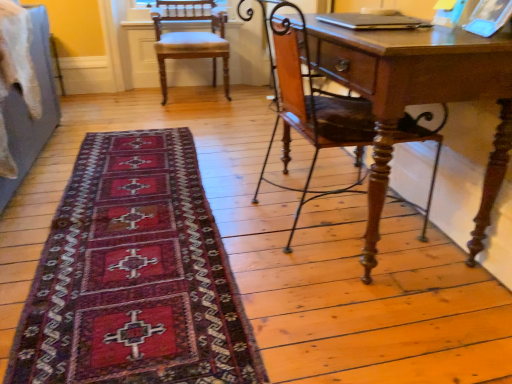
Question: Is the surface of dark red woven rug at lower left in direct contact with wooden chair at right, the 2th chair viewed from the back?

Choices:
 (A) no
 (B) yes

Answer: (A)

Question: Is wooden chair at right, positioned as the 1th chair in front-to-back order, surrounded by dark red woven rug at lower left?

Choices:
 (A) no
 (B) yes

Answer: (A)

Question: From the image's perspective, is dark red woven rug at lower left on wooden chair at right, positioned as the 1th chair in bottom-to-top order?

Choices:
 (A) yes
 (B) no

Answer: (B)

Question: Is the position of dark red woven rug at lower left less distant than that of wooden chair at right, positioned as the 1th chair in front-to-back order?

Choices:
 (A) yes
 (B) no

Answer: (A)

Question: Does dark red woven rug at lower left appear on the left side of wooden chair at right, positioned as the 1th chair in front-to-back order?

Choices:
 (A) no
 (B) yes

Answer: (B)

Question: Is dark red woven rug at lower left thinner than wooden chair at right, which ranks as the 1th chair in right-to-left order?

Choices:
 (A) yes
 (B) no

Answer: (B)

Question: Is dark red woven rug at lower left wider than light brown wood chair at upper left, which appears as the second chair when viewed from the front?

Choices:
 (A) yes
 (B) no

Answer: (A)

Question: Can you confirm if dark red woven rug at lower left is taller than light brown wood chair at upper left, which appears as the second chair when viewed from the front?

Choices:
 (A) no
 (B) yes

Answer: (A)

Question: Is dark red woven rug at lower left oriented away from light brown wood chair at upper left, which appears as the 1th chair when viewed from the back?

Choices:
 (A) yes
 (B) no

Answer: (B)

Question: Considering the relative sizes of dark red woven rug at lower left and light brown wood chair at upper left, placed as the 1th chair when sorted from top to bottom, in the image provided, is dark red woven rug at lower left thinner than light brown wood chair at upper left, placed as the 1th chair when sorted from top to bottom,?

Choices:
 (A) no
 (B) yes

Answer: (A)

Question: Considering the relative positions of dark red woven rug at lower left and light brown wood chair at upper left, placed as the 1th chair when sorted from top to bottom, in the image provided, is dark red woven rug at lower left in front of light brown wood chair at upper left, placed as the 1th chair when sorted from top to bottom,?

Choices:
 (A) no
 (B) yes

Answer: (B)

Question: Is the depth of dark red woven rug at lower left greater than that of light brown wood chair at upper left, arranged as the 2th chair when viewed from the right?

Choices:
 (A) no
 (B) yes

Answer: (A)

Question: Can you confirm if wooden chair at right, marked as the 2th chair in a left-to-right arrangement, is thinner than dark red woven rug at lower left?

Choices:
 (A) no
 (B) yes

Answer: (B)